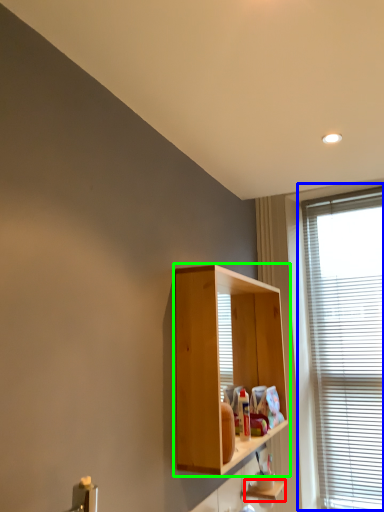
Question: Estimate the real-world distances between objects in this image. Which object is closer to shelf (highlighted by a red box), window (highlighted by a blue box) or cabinetry (highlighted by a green box)?

Choices:
 (A) window
 (B) cabinetry

Answer: (B)